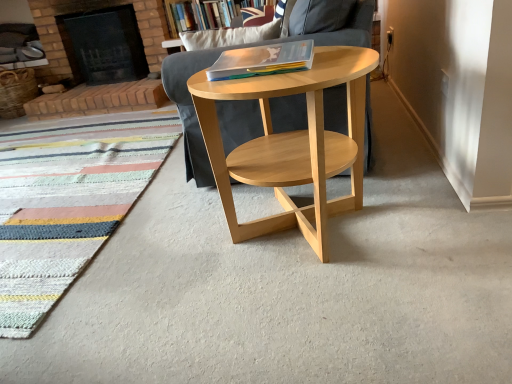
Question: Can you see wooden bookshelf at upper center touching natural wood chair at center?

Choices:
 (A) yes
 (B) no

Answer: (B)

Question: Would you consider wooden bookshelf at upper center to be distant from natural wood chair at center?

Choices:
 (A) yes
 (B) no

Answer: (B)

Question: From a real-world perspective, is wooden bookshelf at upper center below natural wood chair at center?

Choices:
 (A) yes
 (B) no

Answer: (B)

Question: Is wooden bookshelf at upper center thinner than natural wood chair at center?

Choices:
 (A) no
 (B) yes

Answer: (B)

Question: Does wooden bookshelf at upper center contain natural wood chair at center?

Choices:
 (A) no
 (B) yes

Answer: (A)

Question: In terms of width, does translucent plastic folder at center look wider or thinner when compared to brick fireplace at upper left?

Choices:
 (A) wide
 (B) thin

Answer: (B)

Question: In terms of size, does translucent plastic folder at center appear bigger or smaller than brick fireplace at upper left?

Choices:
 (A) small
 (B) big

Answer: (A)

Question: From the image's perspective, is translucent plastic folder at center located above or below brick fireplace at upper left?

Choices:
 (A) above
 (B) below

Answer: (B)

Question: In the image, is translucent plastic folder at center positioned in front of or behind brick fireplace at upper left?

Choices:
 (A) behind
 (B) front

Answer: (B)

Question: Looking at their shapes, would you say multicolored woven mat at lower left is wider or thinner than natural wood chair at center?

Choices:
 (A) thin
 (B) wide

Answer: (B)

Question: From a real-world perspective, is multicolored woven mat at lower left physically located above or below natural wood chair at center?

Choices:
 (A) above
 (B) below

Answer: (B)

Question: From the image's perspective, is multicolored woven mat at lower left above or below natural wood chair at center?

Choices:
 (A) below
 (B) above

Answer: (A)

Question: Which is correct: multicolored woven mat at lower left is inside natural wood chair at center, or outside of it?

Choices:
 (A) inside
 (B) outside

Answer: (B)

Question: Is natural wood chair at center wider or thinner than brick fireplace at upper left?

Choices:
 (A) thin
 (B) wide

Answer: (B)

Question: Relative to brick fireplace at upper left, is natural wood chair at center in front or behind?

Choices:
 (A) behind
 (B) front

Answer: (B)